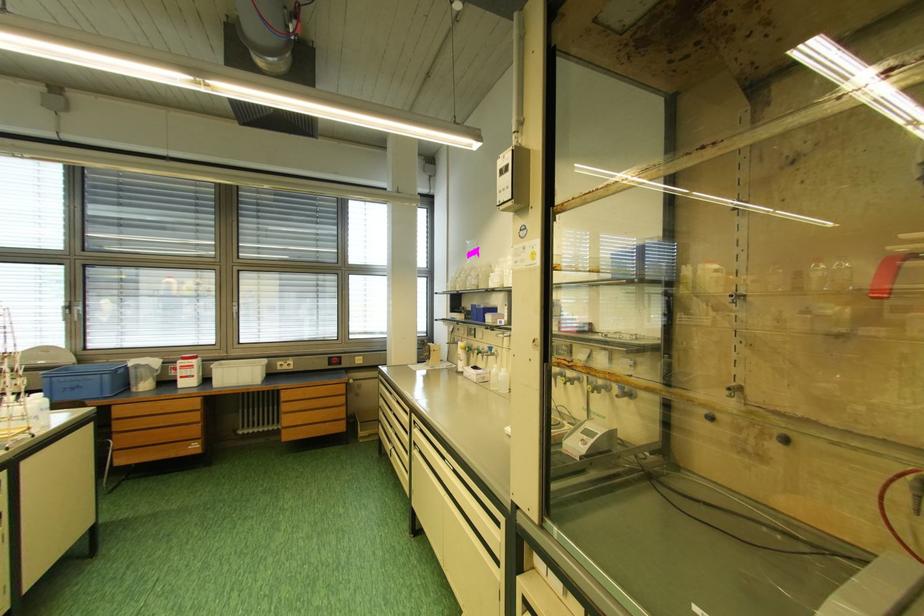
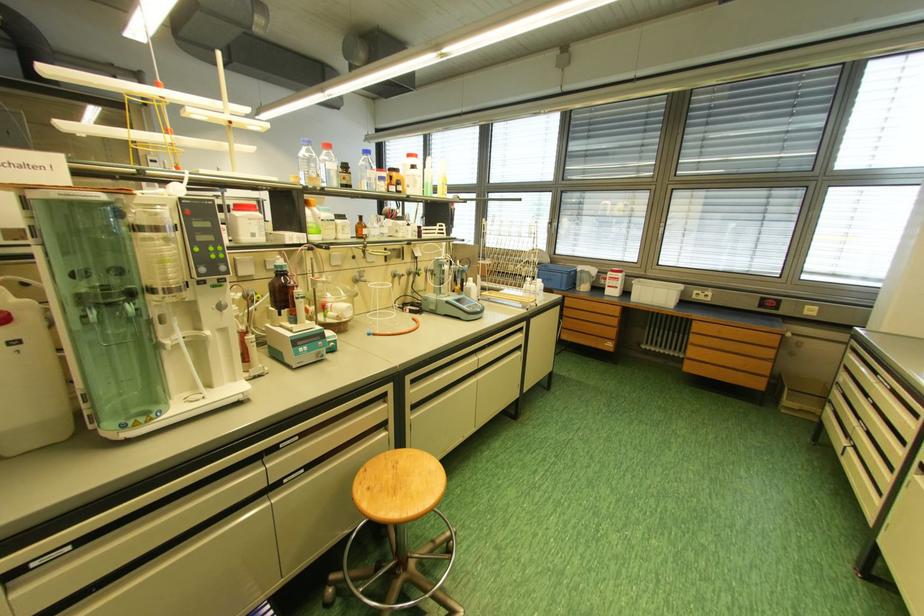
Where in the second image is the point corresponding to (x=335, y=362) from the first image?

(769, 302)